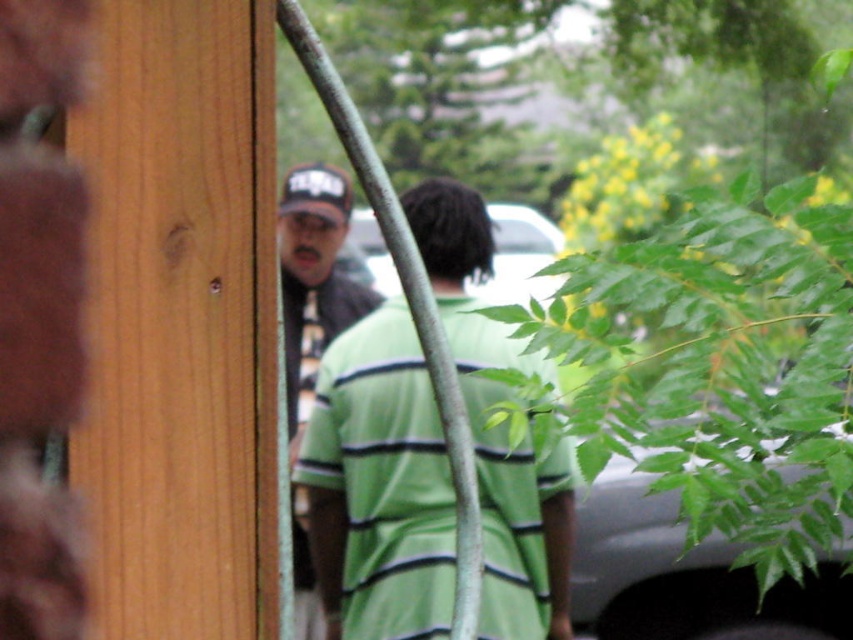
Question: Which object is closer to the camera taking this photo?

Choices:
 (A) matte black cap at upper left
 (B) green striped shirt at center

Answer: (B)

Question: Can you confirm if wooden door at left is positioned to the left of green striped shirt at center?

Choices:
 (A) yes
 (B) no

Answer: (A)

Question: Considering the relative positions of green striped shirt at center and matte black cap at upper left in the image provided, where is green striped shirt at center located with respect to matte black cap at upper left?

Choices:
 (A) right
 (B) left

Answer: (A)

Question: Estimate the real-world distances between objects in this image. Which object is farther from the matte black cap at upper left?

Choices:
 (A) wooden door at left
 (B) green striped shirt at center

Answer: (A)

Question: Is wooden door at left positioned before matte black cap at upper left?

Choices:
 (A) no
 (B) yes

Answer: (B)

Question: Which object is farther from the camera taking this photo?

Choices:
 (A) green striped shirt at center
 (B) wooden door at left
 (C) matte black cap at upper left

Answer: (C)